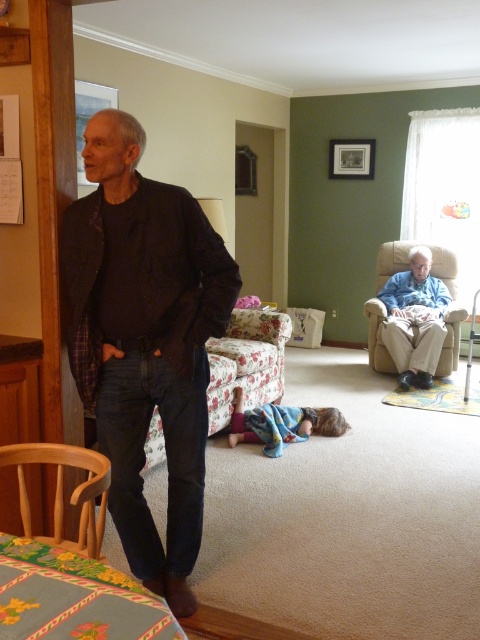
I want to click on dark blue jeans at left, so click(x=144, y=340).

Is point (91, 314) less distant than point (83, 490)?

That is False.

Identify the location of dark blue jeans at left. (144, 340).

Can you confirm if wooden armchair at lower left is positioned above beige fabric armchair at center right?

Actually, wooden armchair at lower left is below beige fabric armchair at center right.

Is wooden armchair at lower left positioned behind beige fabric armchair at center right?

No, wooden armchair at lower left is in front of beige fabric armchair at center right.

Locate an element on the screen. This screenshot has width=480, height=640. wooden armchair at lower left is located at coordinates (62, 492).

Who is positioned more to the right, dark blue jeans at left or beige fabric armchair at center right?

beige fabric armchair at center right is more to the right.

Can you confirm if dark blue jeans at left is positioned above beige fabric armchair at center right?

No, dark blue jeans at left is not above beige fabric armchair at center right.

Is point (74, 257) less distant than point (383, 268)?

Yes, it is.

I want to click on dark blue jeans at left, so click(144, 340).